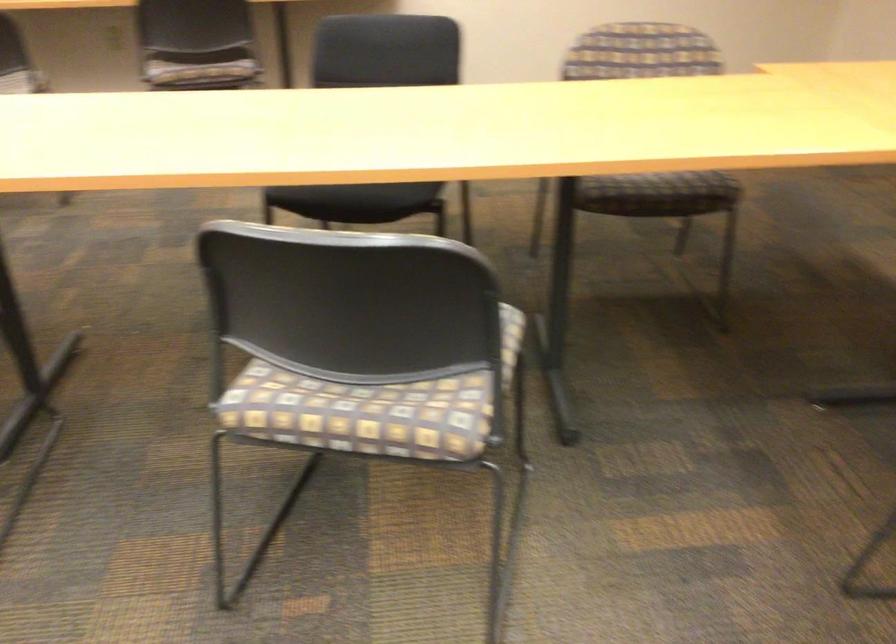
Where is `black chair sitting surface`? The width and height of the screenshot is (896, 644). black chair sitting surface is located at coordinates (355, 202).